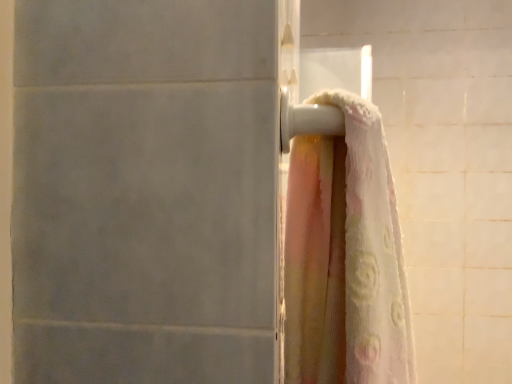
What do you see at coordinates (345, 256) in the screenshot? I see `fluffy cotton towel at center` at bounding box center [345, 256].

This screenshot has width=512, height=384. What are the coordinates of `fluffy cotton towel at center` in the screenshot? It's located at (345, 256).

The image size is (512, 384). Find the location of `fluffy cotton towel at center`. fluffy cotton towel at center is located at coordinates (345, 256).